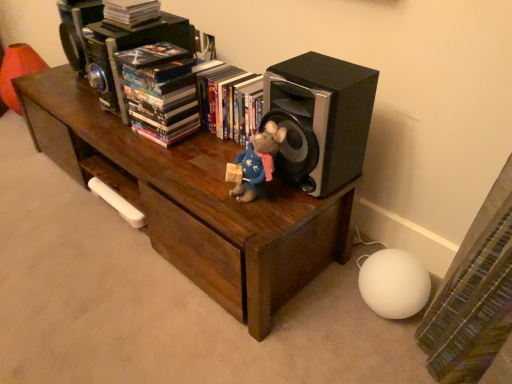
Question: Can you confirm if multicolored paperbacks at upper center, positioned as the second book in right-to-left order, is thinner than hardcover book at center, arranged as the first book when viewed from the right?

Choices:
 (A) no
 (B) yes

Answer: (A)

Question: From a real-world perspective, is multicolored paperbacks at upper center, positioned as the second book in right-to-left order, located beneath hardcover book at center, the third book from the left?

Choices:
 (A) no
 (B) yes

Answer: (A)

Question: From a real-world perspective, is multicolored paperbacks at upper center, positioned as the second book in right-to-left order, on hardcover book at center, the third book from the left?

Choices:
 (A) no
 (B) yes

Answer: (B)

Question: Would you say multicolored paperbacks at upper center, positioned as the second book in right-to-left order, is outside hardcover book at center, the third book from the left?

Choices:
 (A) no
 (B) yes

Answer: (B)

Question: From the image's perspective, is multicolored paperbacks at upper center, the 2th book when ordered from left to right, on top of hardcover book at center, the third book from the left?

Choices:
 (A) no
 (B) yes

Answer: (B)

Question: Is black matte speaker at right in front of or behind brown wood table at center in the image?

Choices:
 (A) behind
 (B) front

Answer: (B)

Question: From a real-world perspective, relative to brown wood table at center, is black matte speaker at right vertically above or below?

Choices:
 (A) below
 (B) above

Answer: (B)

Question: From their relative heights in the image, would you say black matte speaker at right is taller or shorter than brown wood table at center?

Choices:
 (A) short
 (B) tall

Answer: (A)

Question: Does point (287, 165) appear closer or farther from the camera than point (79, 92)?

Choices:
 (A) farther
 (B) closer

Answer: (B)

Question: Is brown wood table at center taller or shorter than black matte speaker at right?

Choices:
 (A) short
 (B) tall

Answer: (B)

Question: From a real-world perspective, relative to black matte speaker at right, is brown wood table at center vertically above or below?

Choices:
 (A) below
 (B) above

Answer: (A)

Question: Considering the positions of brown wood table at center and black matte speaker at right in the image, is brown wood table at center bigger or smaller than black matte speaker at right?

Choices:
 (A) big
 (B) small

Answer: (A)

Question: Is brown wood table at center to the left or to the right of black matte speaker at right in the image?

Choices:
 (A) left
 (B) right

Answer: (A)

Question: From their relative heights in the image, would you say hardcover book at center, arranged as the first book when viewed from the right, is taller or shorter than brown wood table at center?

Choices:
 (A) short
 (B) tall

Answer: (A)

Question: Is point (221, 87) positioned closer to the camera than point (75, 119)?

Choices:
 (A) closer
 (B) farther

Answer: (A)